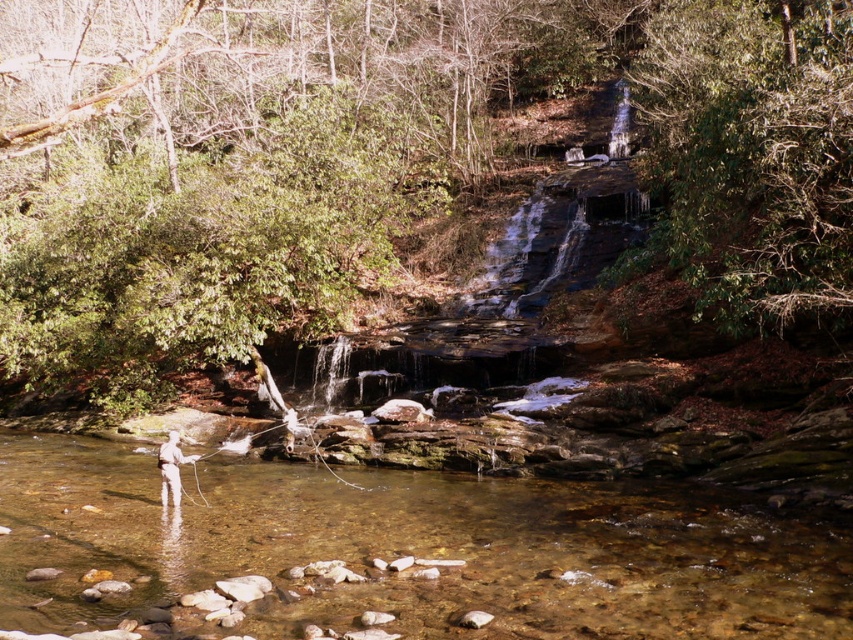
Is clear water at center thinner than green leafy tree at upper right?

In fact, clear water at center might be wider than green leafy tree at upper right.

Consider the image. Is clear water at center bigger than green leafy tree at upper right?

Incorrect, clear water at center is not larger than green leafy tree at upper right.

Locate an element on the screen. This screenshot has height=640, width=853. clear water at center is located at coordinates (405, 550).

Is green leafy tree at center to the left of green leafy tree at upper right from the viewer's perspective?

Yes, green leafy tree at center is to the left of green leafy tree at upper right.

Find the location of a particular element. green leafy tree at center is located at coordinates (390, 163).

Who is lower down, green leafy tree at center or clear water at center?

clear water at center is below.

Measure the distance between point (317, 156) and camera.

They are 84.89 feet apart.

Find the location of a particular element. The width and height of the screenshot is (853, 640). green leafy tree at center is located at coordinates (390, 163).